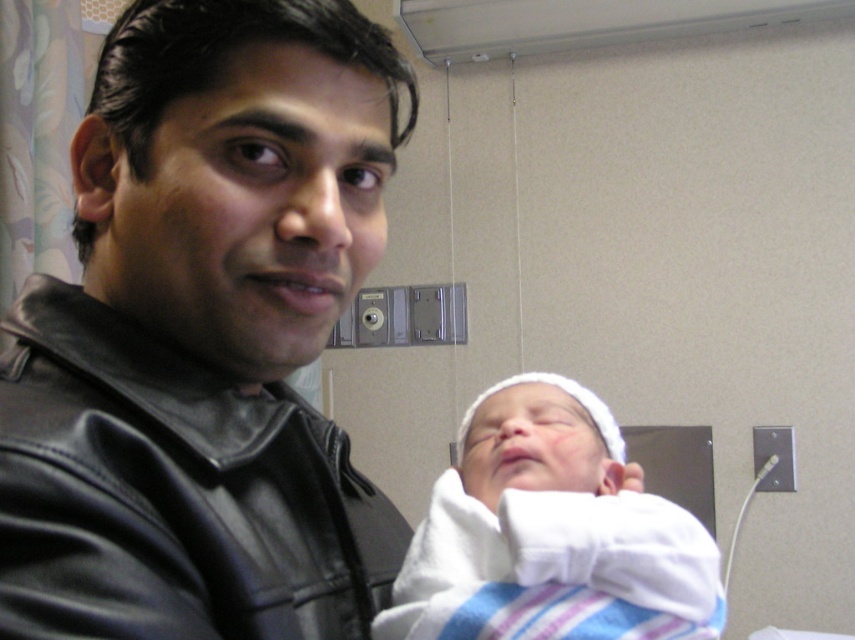
Question: Can you confirm if black leather jacket at left is bigger than white soft cloth at center?

Choices:
 (A) no
 (B) yes

Answer: (A)

Question: Where is black leather jacket at left located in relation to white soft cloth at center in the image?

Choices:
 (A) right
 (B) left

Answer: (B)

Question: Is black leather jacket at left positioned behind white soft cloth at center?

Choices:
 (A) no
 (B) yes

Answer: (A)

Question: Which point is closer to the camera?

Choices:
 (A) white soft cloth at center
 (B) black leather jacket at left

Answer: (B)